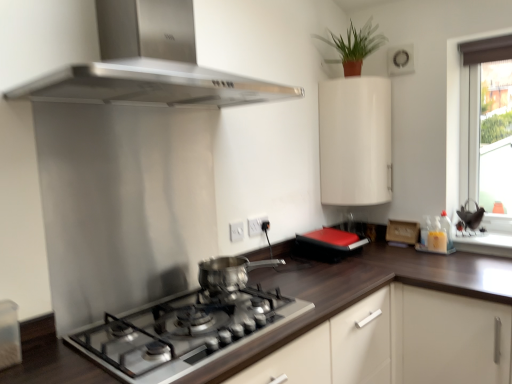
Question: Should I look upward or downward to see green matte plant at upper right?

Choices:
 (A) up
 (B) down

Answer: (A)

Question: Is matte brown curtain at upper right at the left side of dark wood countertop at center?

Choices:
 (A) yes
 (B) no

Answer: (B)

Question: Is matte brown curtain at upper right next to dark wood countertop at center?

Choices:
 (A) no
 (B) yes

Answer: (A)

Question: Does matte brown curtain at upper right have a larger size compared to dark wood countertop at center?

Choices:
 (A) yes
 (B) no

Answer: (B)

Question: Is matte brown curtain at upper right in front of dark wood countertop at center?

Choices:
 (A) no
 (B) yes

Answer: (A)

Question: Would you say dark wood countertop at center is part of matte brown curtain at upper right's contents?

Choices:
 (A) yes
 (B) no

Answer: (B)

Question: From the image's perspective, is matte brown curtain at upper right below dark wood countertop at center?

Choices:
 (A) no
 (B) yes

Answer: (A)

Question: Is satin silver gas stove at center next to stainless steel range hood at upper center and touching it?

Choices:
 (A) no
 (B) yes

Answer: (A)

Question: Considering the relative sizes of satin silver gas stove at center and stainless steel range hood at upper center in the image provided, is satin silver gas stove at center shorter than stainless steel range hood at upper center?

Choices:
 (A) no
 (B) yes

Answer: (B)

Question: Is satin silver gas stove at center wider than stainless steel range hood at upper center?

Choices:
 (A) yes
 (B) no

Answer: (A)

Question: Is satin silver gas stove at center turned away from stainless steel range hood at upper center?

Choices:
 (A) no
 (B) yes

Answer: (A)

Question: Is satin silver gas stove at center bigger than stainless steel range hood at upper center?

Choices:
 (A) no
 (B) yes

Answer: (A)

Question: Is satin silver gas stove at center facing towards stainless steel range hood at upper center?

Choices:
 (A) no
 (B) yes

Answer: (A)

Question: Considering the relative sizes of dark wood countertop at center and green matte plant at upper right in the image provided, is dark wood countertop at center thinner than green matte plant at upper right?

Choices:
 (A) yes
 (B) no

Answer: (B)